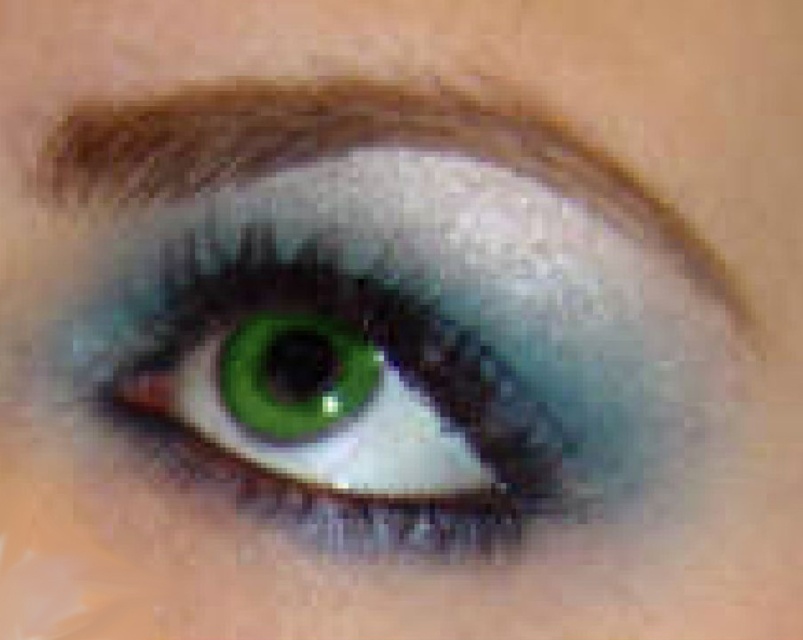
Question: Does green matte eye at center lie in front of teal matte eye at center?

Choices:
 (A) no
 (B) yes

Answer: (B)

Question: Is green matte eye at center closer to the viewer compared to brown matte eyebrow at upper left?

Choices:
 (A) yes
 (B) no

Answer: (B)

Question: Which object is closer to the camera taking this photo?

Choices:
 (A) brown matte eyebrow at upper left
 (B) teal matte eye at center

Answer: (A)

Question: Is the position of green matte eye at center more distant than that of brown matte eyebrow at upper left?

Choices:
 (A) no
 (B) yes

Answer: (B)

Question: Which is farther from the teal matte eye at center?

Choices:
 (A) brown matte eyebrow at upper left
 (B) green matte eye at center

Answer: (A)

Question: Which point is closer to the camera?

Choices:
 (A) (361, 353)
 (B) (283, 312)

Answer: (B)